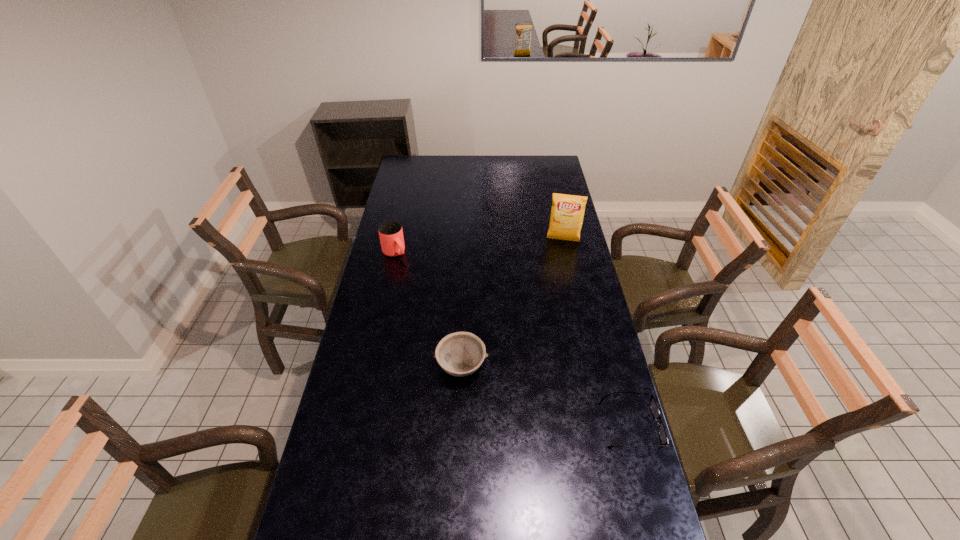
The width and height of the screenshot is (960, 540). Find the location of `the third tallest object`. the third tallest object is located at coordinates (460, 354).

Locate an element on the screen. the third farthest object is located at coordinates (460, 354).

Locate an element on the screen. The image size is (960, 540). spectacles is located at coordinates (653, 404).

You are a GUI agent. You are given a task and a screenshot of the screen. Output one action in this format:
    pyautogui.click(x=<x>, y=<y>)
    Task: Click on the shortest object
    
    Given the screenshot: What is the action you would take?
    pyautogui.click(x=653, y=404)

This screenshot has width=960, height=540. In order to click on the tallest object in this screenshot , I will do `click(567, 212)`.

Where is `cup`? This screenshot has height=540, width=960. cup is located at coordinates (390, 232).

Locate an element on the screen. This screenshot has height=540, width=960. the leftmost object is located at coordinates (390, 232).

Where is `free space located on the back of the second nearest object`? free space located on the back of the second nearest object is located at coordinates (463, 334).

Locate an element on the screen. The height and width of the screenshot is (540, 960). vacant area situated on the front of the crisp (potato chip) with the logo is located at coordinates (554, 307).

You are a GUI agent. You are given a task and a screenshot of the screen. Output one action in this format:
    pyautogui.click(x=<x>, y=<y>)
    Task: Click on the vacant space situated 0.180m on the front of the crisp (potato chip) with the logo
    
    Given the screenshot: What is the action you would take?
    pyautogui.click(x=558, y=271)